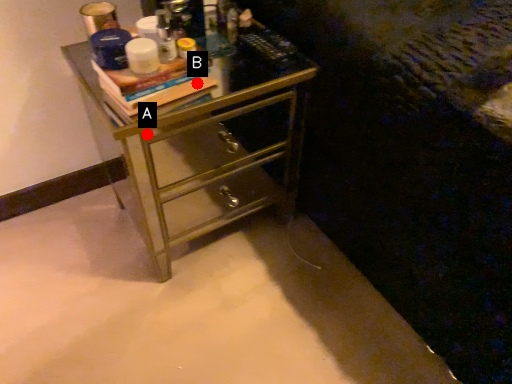
Question: Two points are circled on the image, labeled by A and B beside each circle. Among these points, which one is nearest to the camera?

Choices:
 (A) A is closer
 (B) B is closer

Answer: (A)